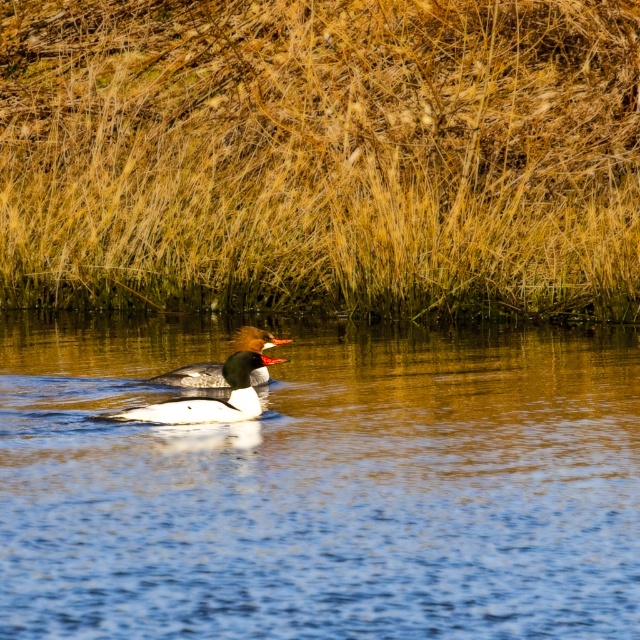
Is dry grass at upper center further to the viewer compared to shiny brown duck at center?

Yes, dry grass at upper center is further from the viewer.

Is point (8, 250) farther from camera compared to point (192, 380)?

Yes, it is behind point (192, 380).

This screenshot has width=640, height=640. I want to click on dry grass at upper center, so [317, 150].

Between point (433, 237) and point (259, 337), which one is positioned in front?

Point (259, 337) is in front.

Does point (3, 294) come behind point (241, 413)?

Yes, it is behind point (241, 413).

I want to click on dry grass at upper center, so click(x=317, y=150).

Who is positioned more to the right, white glossy duck at center or shiny brown duck at center?

white glossy duck at center

Between point (275, 358) and point (259, 372), which one is positioned behind?

Point (259, 372)

Does point (236, 356) come in front of point (212, 381)?

Yes, point (236, 356) is closer to viewer.

Image resolution: width=640 pixels, height=640 pixels. I want to click on white glossy duck at center, so [x=214, y=385].